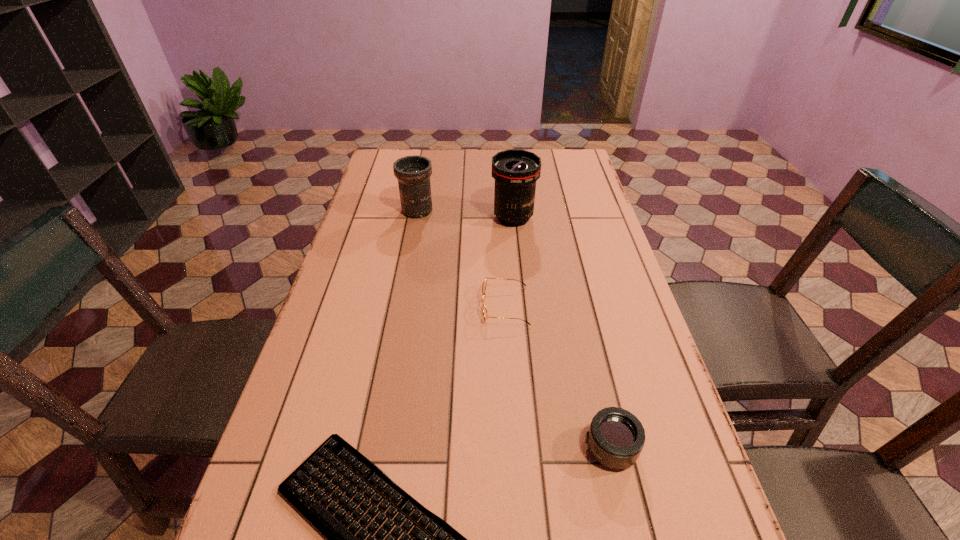
Image resolution: width=960 pixels, height=540 pixels. In order to click on blank space located 0.260m on the side of the rightmost object with brand markings and control switches in this screenshot , I will do `click(448, 447)`.

The width and height of the screenshot is (960, 540). Identify the location of vacant point located 0.380m on the side of the rightmost object with brand markings and control switches. (386, 447).

Identify the location of vacant space located on the side of the rightmost object with brand markings and control switches. [x=491, y=447].

This screenshot has width=960, height=540. In order to click on free space located on the front-facing side of the fourth tallest object in this screenshot , I will do `click(396, 306)`.

In order to click on vacant space located 0.380m on the front-facing side of the fourth tallest object in this screenshot , I will do [x=333, y=306].

Locate an element on the screen. The image size is (960, 540). vacant space positioned on the front-facing side of the fourth tallest object is located at coordinates (439, 306).

Locate an element on the screen. The image size is (960, 540). object that is at the left edge is located at coordinates (413, 173).

Find the location of a particular element. object that is at the right edge is located at coordinates (616, 437).

Identify the location of free space at the far edge of the desktop. (447, 159).

The width and height of the screenshot is (960, 540). Identify the location of vacant space at the left edge of the desktop. (379, 198).